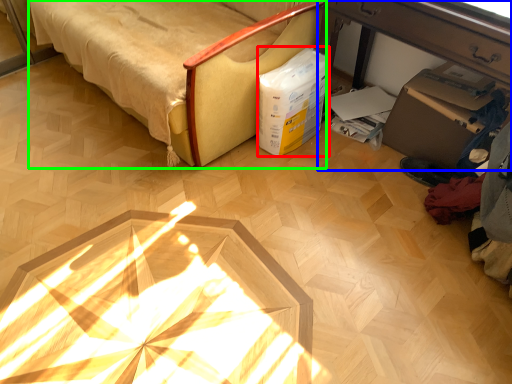
Question: Which object is the closest to the box (highlighted by a red box)? Choose among these: table (highlighted by a blue box) or furniture (highlighted by a green box).

Choices:
 (A) table
 (B) furniture

Answer: (A)